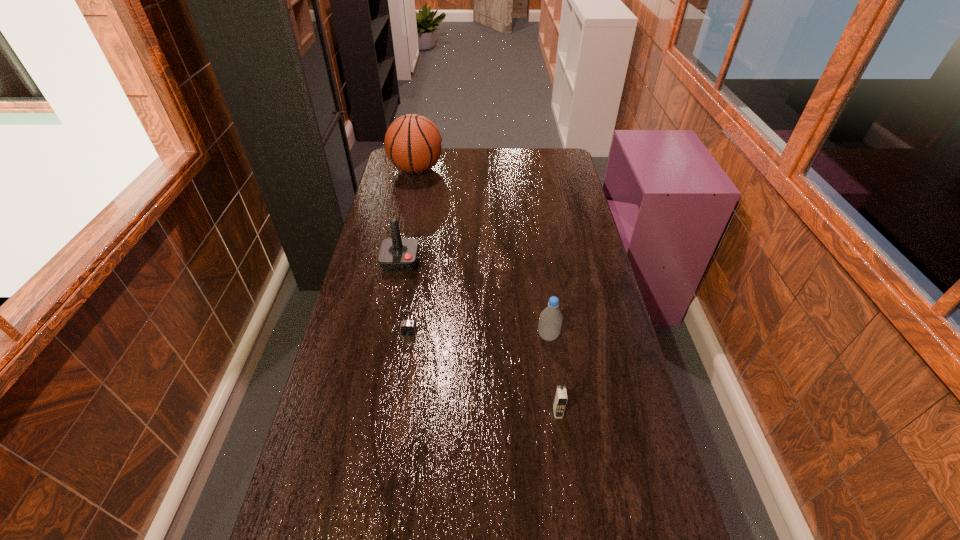
The height and width of the screenshot is (540, 960). Find the location of `unoccupied area between the cellular telephone and the farthest object`. unoccupied area between the cellular telephone and the farthest object is located at coordinates (487, 291).

Find the location of a particular element. The image size is (960, 540). free area in between the joystick and the bottle is located at coordinates (474, 299).

Identify the location of free space between the bottle and the cellular telephone. This screenshot has width=960, height=540. (553, 374).

Locate an element on the screen. unoccupied position between the joystick and the bottle is located at coordinates (474, 299).

Where is `free space between the nearest object and the shortest object`? This screenshot has height=540, width=960. free space between the nearest object and the shortest object is located at coordinates (483, 372).

At what (x,y) coordinates should I click in order to perform the action: click on unoccupied position between the cellular telephone and the bottle. Please return your answer as a coordinate pair (x, y). This screenshot has width=960, height=540. Looking at the image, I should click on (x=553, y=374).

Where is `free spot between the joystick and the nearest object`? free spot between the joystick and the nearest object is located at coordinates (479, 336).

Locate an element on the screen. free area in between the basketball and the cellular telephone is located at coordinates (487, 291).

Locate which object is the third closest to the farthest object. Please provide its 2D coordinates. Your answer should be formatted as a tuple, i.e. [(x, y)], where the tuple contains the x and y coordinates of a point satisfying the conditions above.

[(550, 321)]

Identify which object is the third closest to the cellular telephone. Please provide its 2D coordinates. Your answer should be formatted as a tuple, i.e. [(x, y)], where the tuple contains the x and y coordinates of a point satisfying the conditions above.

[(396, 254)]